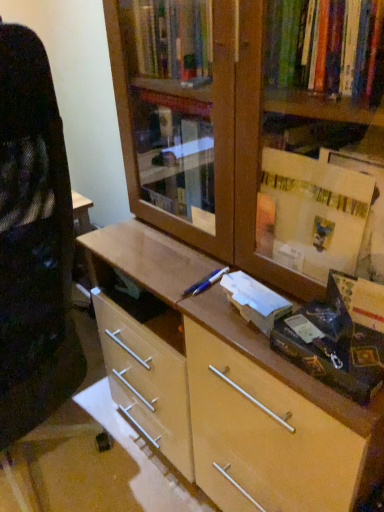
Question: Is white paper at center not close to blue metallic pen at center?

Choices:
 (A) yes
 (B) no

Answer: (B)

Question: Is white paper at center oriented away from blue metallic pen at center?

Choices:
 (A) yes
 (B) no

Answer: (B)

Question: Does white paper at center have a lesser width compared to blue metallic pen at center?

Choices:
 (A) yes
 (B) no

Answer: (A)

Question: From a real-world perspective, does white paper at center sit lower than blue metallic pen at center?

Choices:
 (A) no
 (B) yes

Answer: (A)

Question: From the image's perspective, is white paper at center under blue metallic pen at center?

Choices:
 (A) no
 (B) yes

Answer: (B)

Question: Considering the relative sizes of white paper at center and blue metallic pen at center in the image provided, is white paper at center smaller than blue metallic pen at center?

Choices:
 (A) no
 (B) yes

Answer: (A)

Question: Does blue metallic pen at center contain white paper at center?

Choices:
 (A) yes
 (B) no

Answer: (B)

Question: Is blue metallic pen at center bigger than white paper at center?

Choices:
 (A) yes
 (B) no

Answer: (B)

Question: Is blue metallic pen at center oriented away from white paper at center?

Choices:
 (A) yes
 (B) no

Answer: (B)

Question: Is the position of blue metallic pen at center more distant than that of white paper at center?

Choices:
 (A) no
 (B) yes

Answer: (B)

Question: Is blue metallic pen at center positioned far away from white paper at center?

Choices:
 (A) no
 (B) yes

Answer: (A)

Question: Is blue metallic pen at center not within white paper at center?

Choices:
 (A) yes
 (B) no

Answer: (A)

Question: From a real-world perspective, relative to blue metallic pen at center, is white paper at center vertically above or below?

Choices:
 (A) below
 (B) above

Answer: (B)